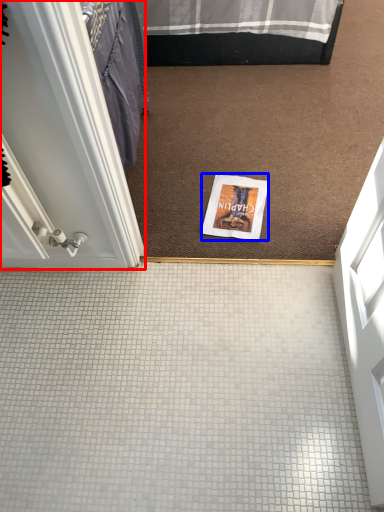
Question: Which of the following is the closest to the observer, door (highlighted by a red box) or magazine (highlighted by a blue box)?

Choices:
 (A) door
 (B) magazine

Answer: (A)